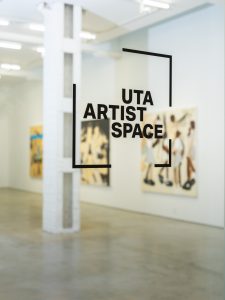
Where is `white grooved support pillar`? white grooved support pillar is located at coordinates (50, 166).